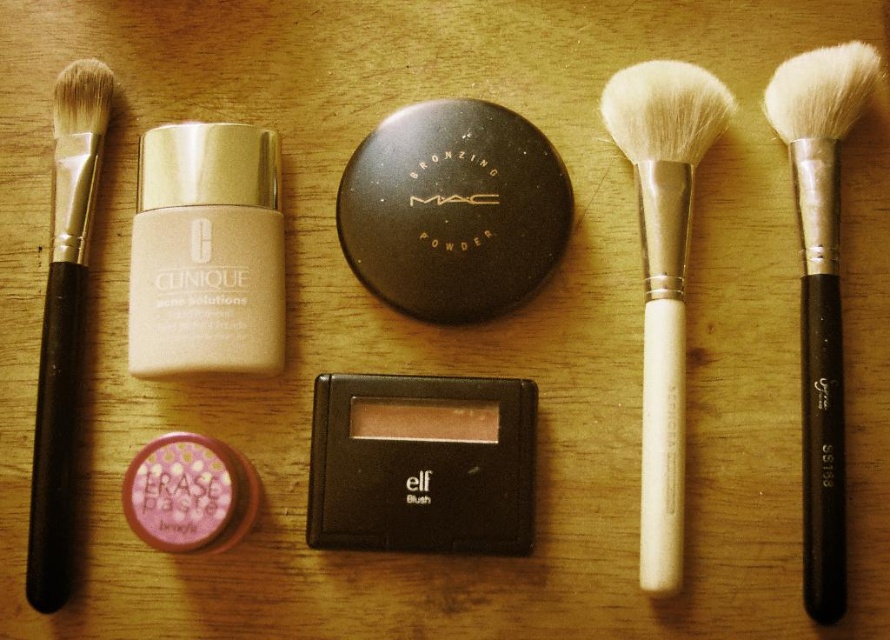
Question: Estimate the real-world distances between objects in this image. Which object is closer to the matte cream foundation at upper left?

Choices:
 (A) shiny pink eraser paste at bottom left
 (B) black matte brush at left
 (C) white wood-handled brush at center-right

Answer: (B)

Question: Does white synthetic hair brush at right come behind shiny pink eraser paste at bottom left?

Choices:
 (A) yes
 (B) no

Answer: (B)

Question: From the image, what is the correct spatial relationship of white wood-handled brush at center-right in relation to white synthetic hair brush at right?

Choices:
 (A) below
 (B) above

Answer: (B)

Question: Is matte cream foundation at upper left smaller than white synthetic hair brush at right?

Choices:
 (A) yes
 (B) no

Answer: (A)

Question: Which point is closer to the camera?

Choices:
 (A) black matte brush at left
 (B) white synthetic hair brush at right
 (C) matte cream foundation at upper left
 (D) shiny pink eraser paste at bottom left

Answer: (A)

Question: Among these points, which one is farthest from the camera?

Choices:
 (A) (192, 198)
 (B) (38, 372)

Answer: (A)